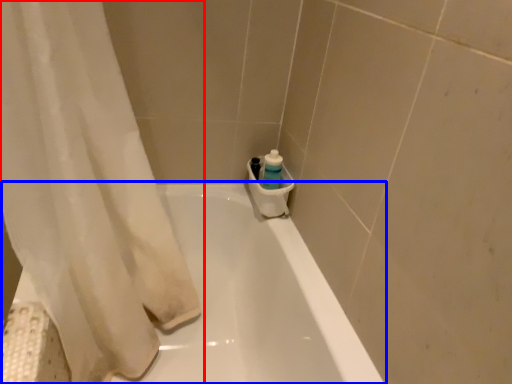
Question: Which object is closer to the camera taking this photo, curtain (highlighted by a red box) or bathtub (highlighted by a blue box)?

Choices:
 (A) curtain
 (B) bathtub

Answer: (A)